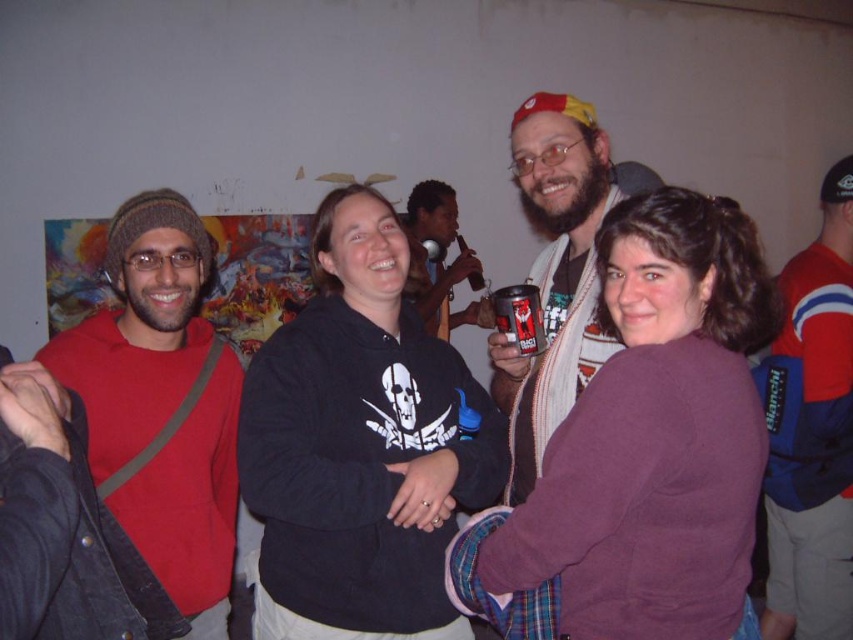
Can you confirm if matte red hoodie at left is thinner than metallic can at center?

In fact, matte red hoodie at left might be wider than metallic can at center.

Between matte red hoodie at left and metallic can at center, which one has more height?

matte red hoodie at left is taller.

Which is in front, point (120, 355) or point (521, 352)?

Point (521, 352) is more forward.

This screenshot has height=640, width=853. Identify the location of matte red hoodie at left. (161, 404).

How distant is red and blue jacket at right from metallic can at center?

red and blue jacket at right and metallic can at center are 1.07 meters apart.

Does red and blue jacket at right have a lesser width compared to metallic can at center?

Incorrect, red and blue jacket at right's width is not less than metallic can at center's.

Between point (837, 424) and point (532, 323), which one is positioned behind?

The point (837, 424) is behind.

At what (x,y) coordinates should I click in order to perform the action: click on red and blue jacket at right. Please return your answer as a coordinate pair (x, y). This screenshot has width=853, height=640. Looking at the image, I should click on (815, 433).

Is point (608, 176) farther from viewer compared to point (440, 227)?

No.

Is beige scarf at center taller than matte black microphone at center?

Yes.

Where is `beige scarf at center`? This screenshot has width=853, height=640. beige scarf at center is located at coordinates (556, 272).

Identify the location of beige scarf at center. (556, 272).